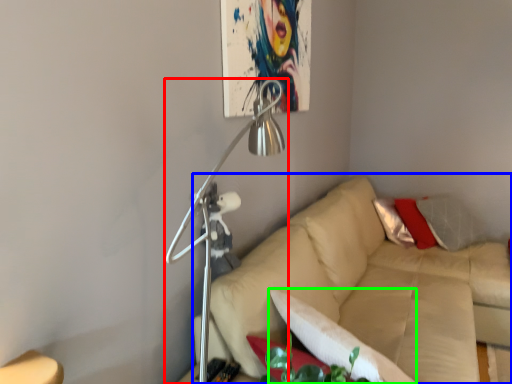
Question: Which is nearer to the lamp (highlighted by a red box)? studio couch (highlighted by a blue box) or pillow (highlighted by a green box).

Choices:
 (A) studio couch
 (B) pillow

Answer: (B)